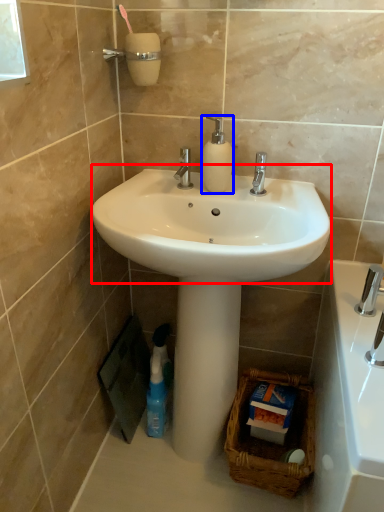
Question: Among these objects, which one is farthest to the camera, sink (highlighted by a red box) or soap dispenser (highlighted by a blue box)?

Choices:
 (A) sink
 (B) soap dispenser

Answer: (B)